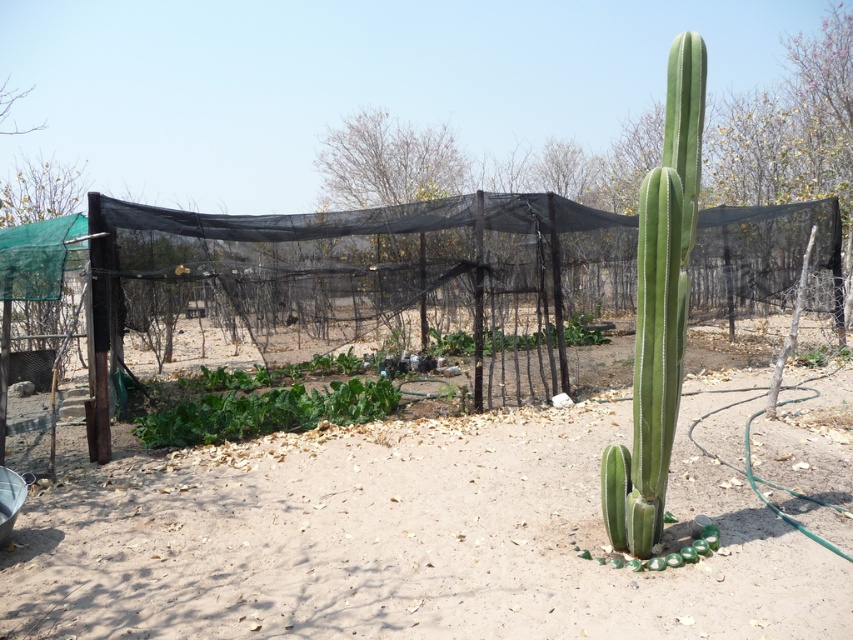
Who is taller, dirt at center or green smooth cactus at right?

Standing taller between the two is green smooth cactus at right.

Who is lower down, dirt at center or green smooth cactus at right?

Positioned lower is dirt at center.

In order to click on dirt at center in this screenshot , I will do `click(402, 538)`.

Is dirt at center positioned before green leafy at center?

That is True.

Can you confirm if dirt at center is positioned above green leafy at center?

No.

Is point (792, 612) closer to viewer compared to point (334, 403)?

That is True.

The width and height of the screenshot is (853, 640). What are the coordinates of `dirt at center` in the screenshot? It's located at (402, 538).

Between green leafy at center and green leafy plant at center, which one is positioned lower?

green leafy at center

Does green leafy at center have a greater height compared to green leafy plant at center?

Indeed, green leafy at center has a greater height compared to green leafy plant at center.

Measure the distance between green leafy at center and camera.

green leafy at center is 6.76 meters from camera.

I want to click on green leafy at center, so click(x=265, y=412).